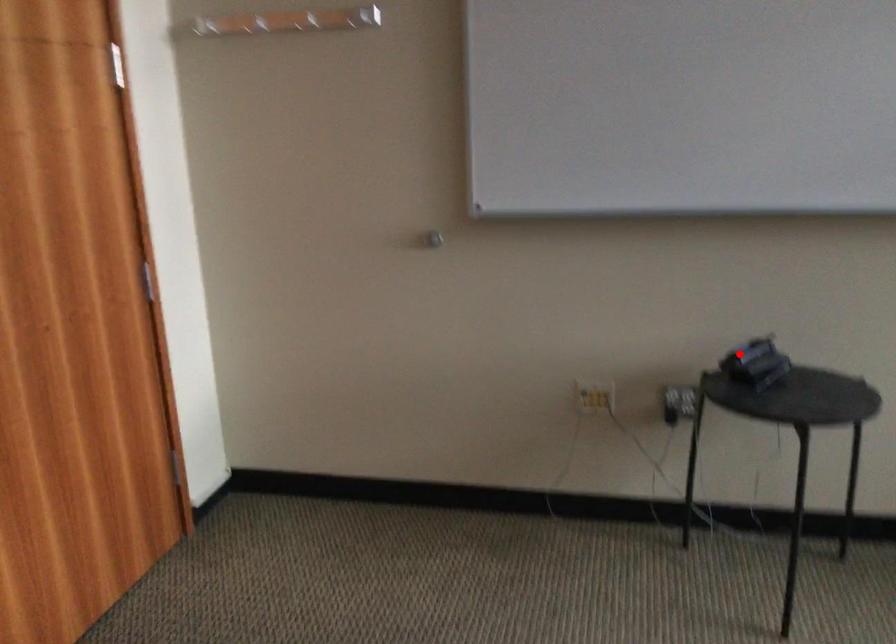
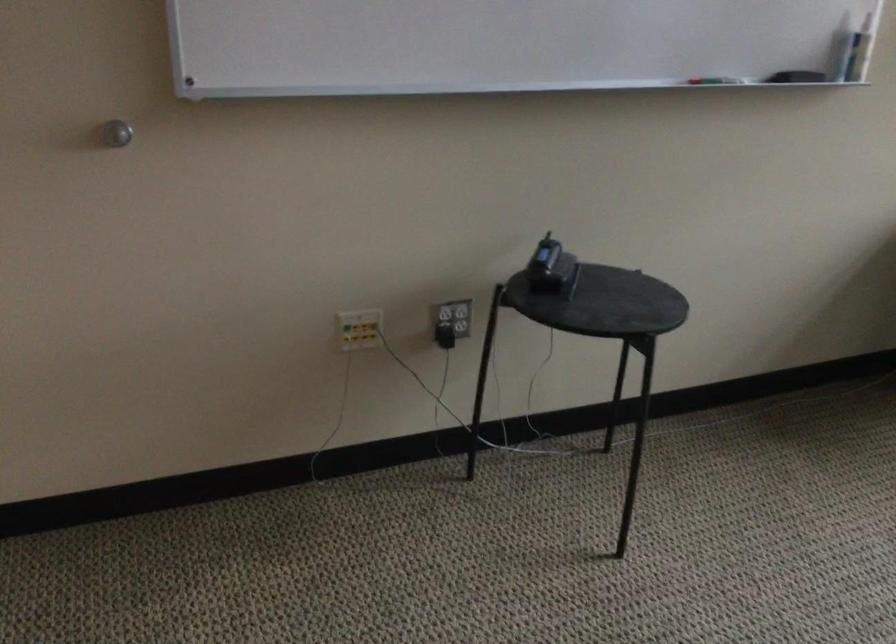
The point at the highlighted location is marked in the first image. Where is the corresponding point in the second image?

(550, 268)